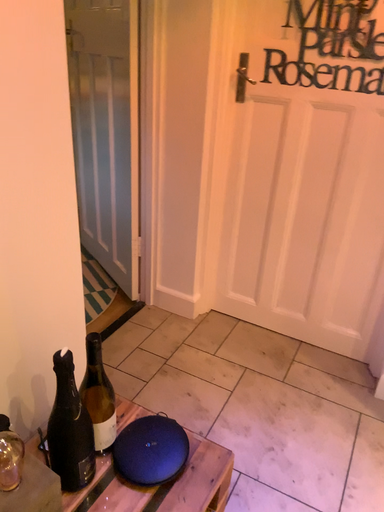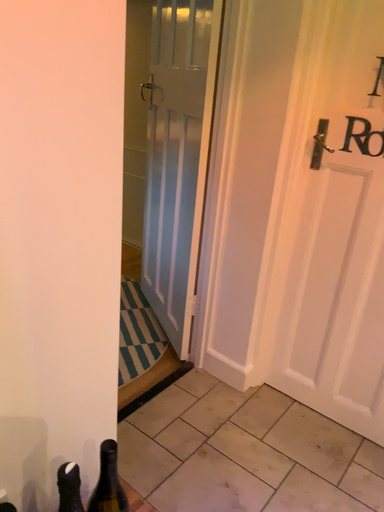
Question: Which way did the camera rotate in the video?

Choices:
 (A) rotated right
 (B) rotated left

Answer: (B)